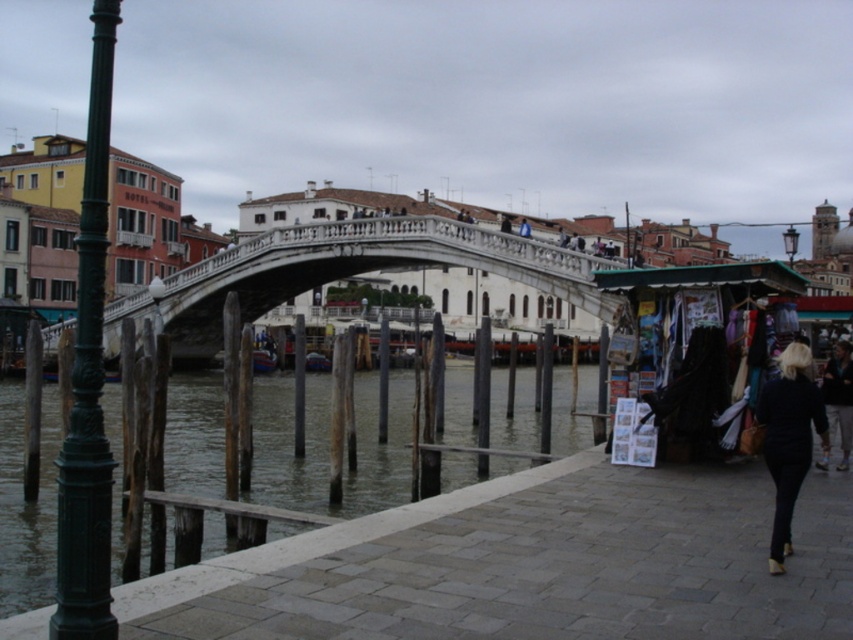
Who is higher up, black leather jacket at lower right or blue fabric at center?

blue fabric at center is higher up.

Between point (786, 460) and point (520, 225), which one is positioned in front?

Point (786, 460) is in front.

Which is in front, point (772, 531) or point (523, 228)?

Positioned in front is point (772, 531).

Identify the location of black leather jacket at lower right. (788, 438).

The width and height of the screenshot is (853, 640). What do you see at coordinates (328, 445) in the screenshot?
I see `greenish water at lower left` at bounding box center [328, 445].

Can you confirm if greenish water at lower left is positioned above dark blue jeans at lower right?

Actually, greenish water at lower left is below dark blue jeans at lower right.

Identify the location of greenish water at lower left. The height and width of the screenshot is (640, 853). (328, 445).

The height and width of the screenshot is (640, 853). In order to click on greenish water at lower left in this screenshot , I will do [x=328, y=445].

Does white stone bridge at center appear on the left side of green polished metal pole at left?

No, white stone bridge at center is not to the left of green polished metal pole at left.

Does point (117, 337) come in front of point (85, 177)?

No, it is not.

Image resolution: width=853 pixels, height=640 pixels. Find the location of `white stone bridge at center`. white stone bridge at center is located at coordinates (349, 272).